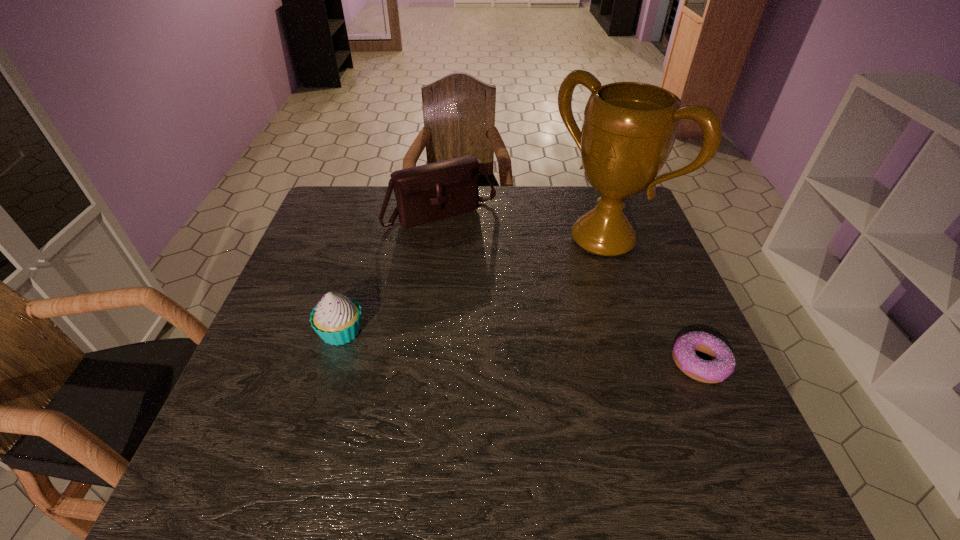
You are a GUI agent. You are given a task and a screenshot of the screen. Output one action in this format:
    pyautogui.click(x=<x>, y=<y>)
    Task: Click on the vacant space at the right edge of the desktop
    Image resolution: width=960 pixels, height=540 pixels.
    Given the screenshot: What is the action you would take?
    pyautogui.click(x=717, y=385)

Where is `vacant area at the far left corner of the desktop`? Image resolution: width=960 pixels, height=540 pixels. vacant area at the far left corner of the desktop is located at coordinates (334, 221).

Where is `vacant space at the far right corner`? vacant space at the far right corner is located at coordinates (588, 201).

Where is `vacant region between the shoulder bag and the doughnut`? vacant region between the shoulder bag and the doughnut is located at coordinates (571, 288).

Find the location of a particular element. The width and height of the screenshot is (960, 540). vacant space that's between the second shortest object and the second tallest object is located at coordinates (391, 273).

Find the location of a particular element. Image resolution: width=960 pixels, height=540 pixels. empty space that is in between the shortest object and the third shortest object is located at coordinates (571, 288).

I want to click on empty location between the cupcake and the shoulder bag, so click(391, 273).

Locate an element on the screen. This screenshot has height=540, width=960. vacant area that lies between the doughnut and the third shortest object is located at coordinates (571, 288).

The width and height of the screenshot is (960, 540). Identify the location of free space between the tallest object and the third tallest object. (472, 285).

I want to click on vacant area between the cupcake and the doughnut, so click(x=521, y=347).